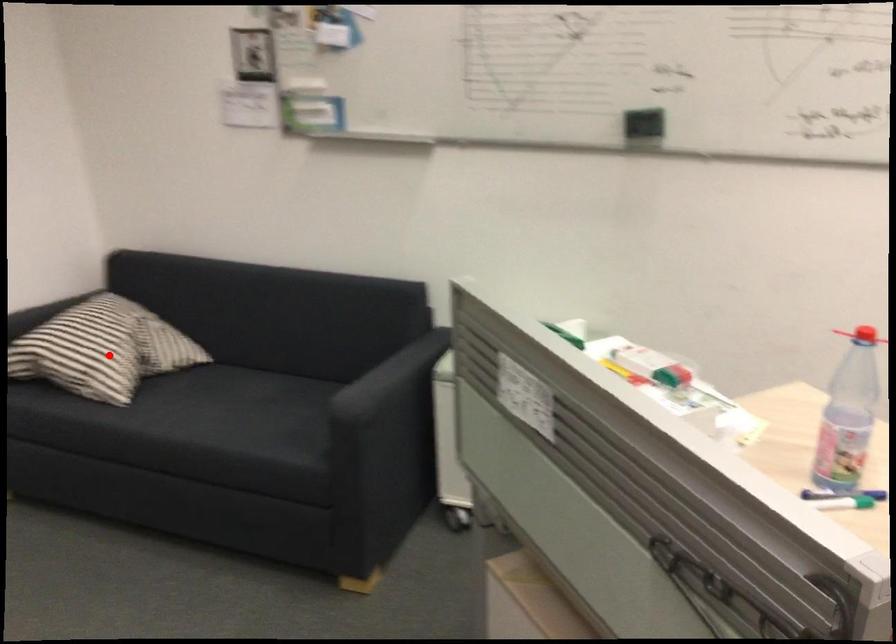
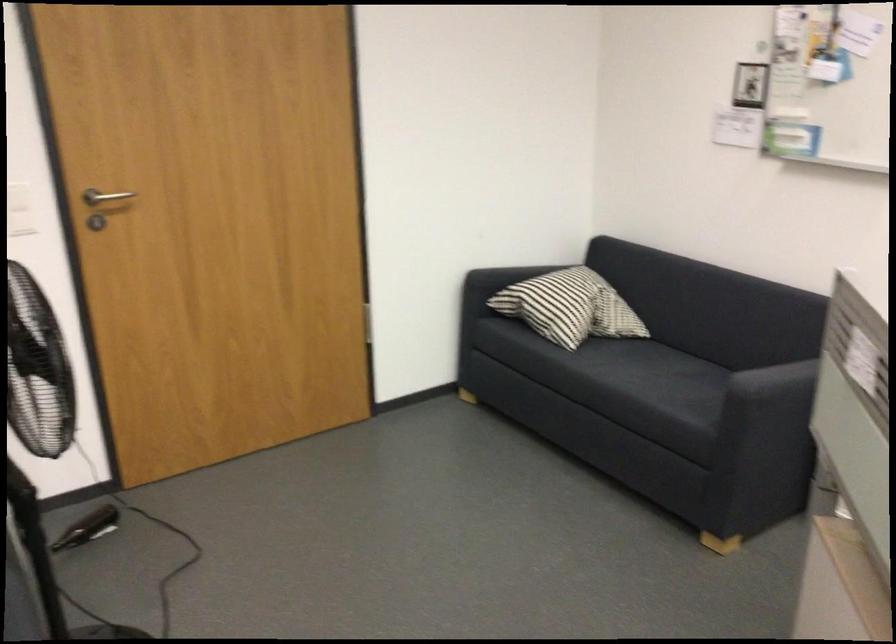
Question: I am providing you with two images of the same scene from different viewpoints. A red point is marked on the first image. Can you still see the location of the red point in image 2?

Choices:
 (A) Yes
 (B) No

Answer: (A)